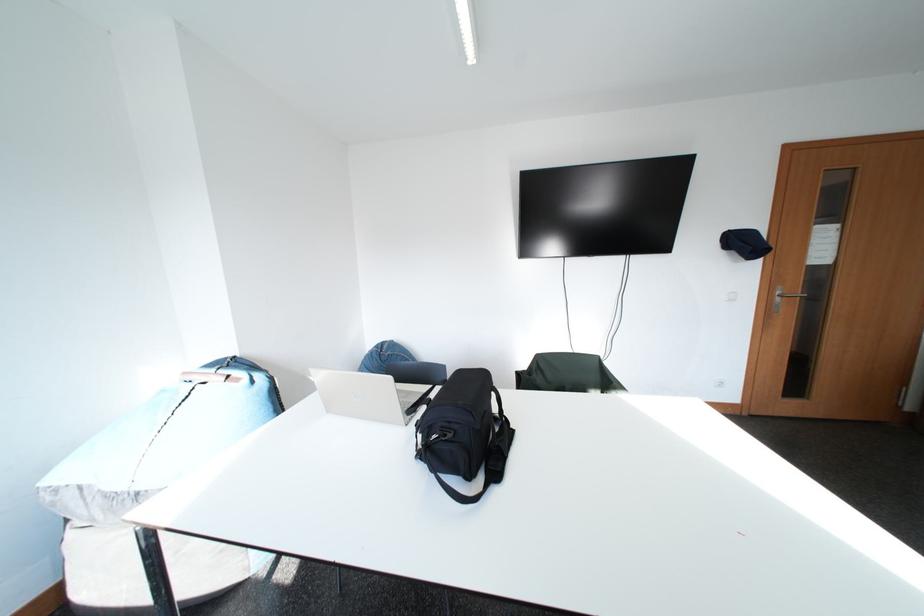
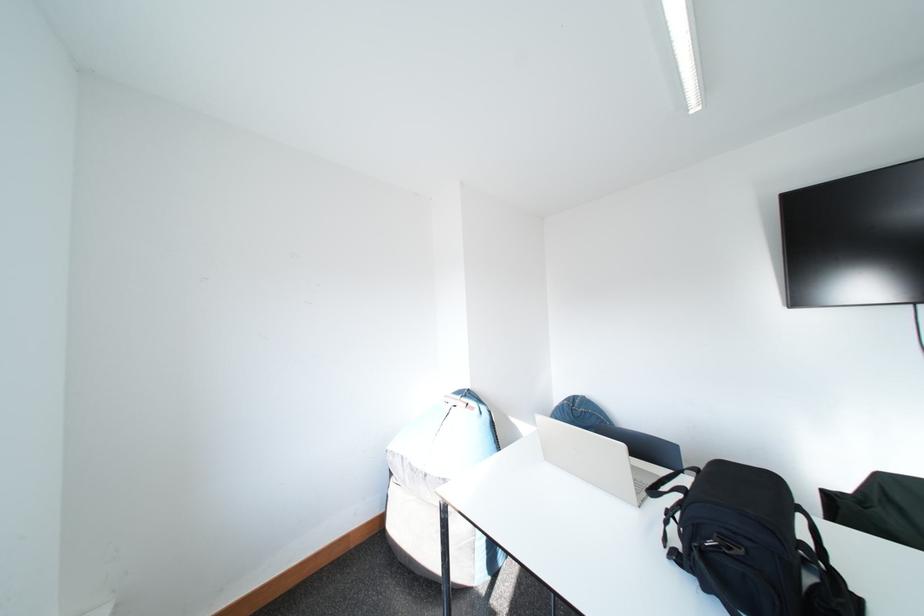
Locate, in the second image, the point that corresponds to (339,415) in the first image.

(557, 463)